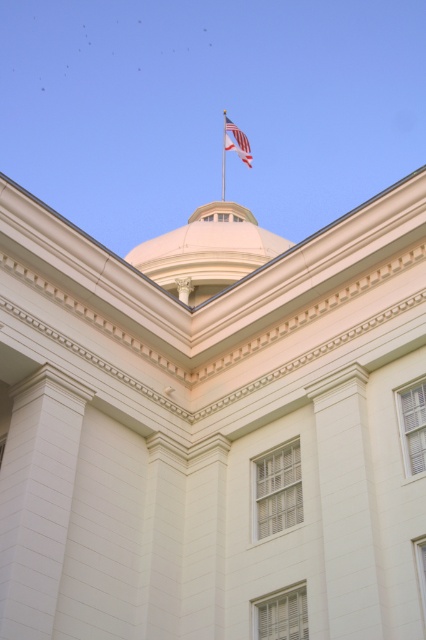
You are standing in front of the classical building and want to determine the spatial relationship between two specific points marked on the facade. Which of the two points, point 1 at coordinates (236, 129) or point 2 at coordinates (222, 154), is closer to your current position?

Point 1 at coordinates (236, 129) is closer to your current position because it is closer to the camera than point 2 at coordinates (222, 154).

You are a photographer standing in front of the classical building. You want to capture both the white smooth dome at center and the american flag at upper center in a single frame. Which object should you focus on first if you want to ensure both are in focus?

The white smooth dome at center is larger in size than the american flag at upper center, so focusing on the dome first would help ensure both are in focus since it is the larger object and occupies more space in the frame.

You are standing in front of the classical building and want to take a photo of the white smooth dome at center. Where should you aim your camera to capture the dome in the center of your photo?

The white smooth dome at center is located at the coordinates (207, 252), so you should aim your camera at that point to center the dome in your photo.